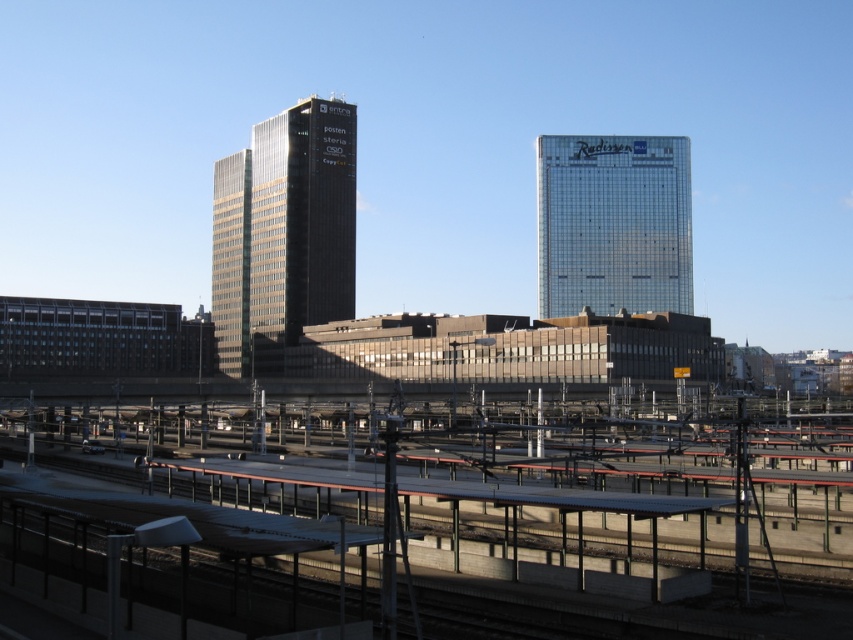
In the scene shown: Can you confirm if transparent glass building at center is wider than black glass building at lower left?

Correct, the width of transparent glass building at center exceeds that of black glass building at lower left.

Can you confirm if transparent glass building at center is shorter than black glass building at lower left?

Incorrect, transparent glass building at center's height does not fall short of black glass building at lower left's.

Find the location of a particular element. The image size is (853, 640). transparent glass building at center is located at coordinates (613, 224).

Is concrete platform at lower center thinner than transparent glass building at center?

In fact, concrete platform at lower center might be wider than transparent glass building at center.

Can you confirm if concrete platform at lower center is taller than transparent glass building at center?

No, concrete platform at lower center is not taller than transparent glass building at center.

Identify the location of concrete platform at lower center. Image resolution: width=853 pixels, height=640 pixels. (228, 518).

Looking at this image, measure the distance between concrete platform at lower center and black glass building at lower left.

The distance of concrete platform at lower center from black glass building at lower left is 409.74 feet.

What do you see at coordinates (228, 518) in the screenshot?
I see `concrete platform at lower center` at bounding box center [228, 518].

Where is `concrete platform at lower center`? This screenshot has height=640, width=853. concrete platform at lower center is located at coordinates (x=228, y=518).